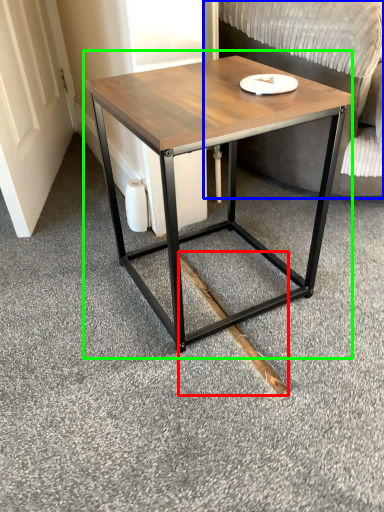
Question: Considering the real-world distances, which object is closest to wood (highlighted by a red box)? swivel chair (highlighted by a blue box) or coffee table (highlighted by a green box).

Choices:
 (A) swivel chair
 (B) coffee table

Answer: (B)